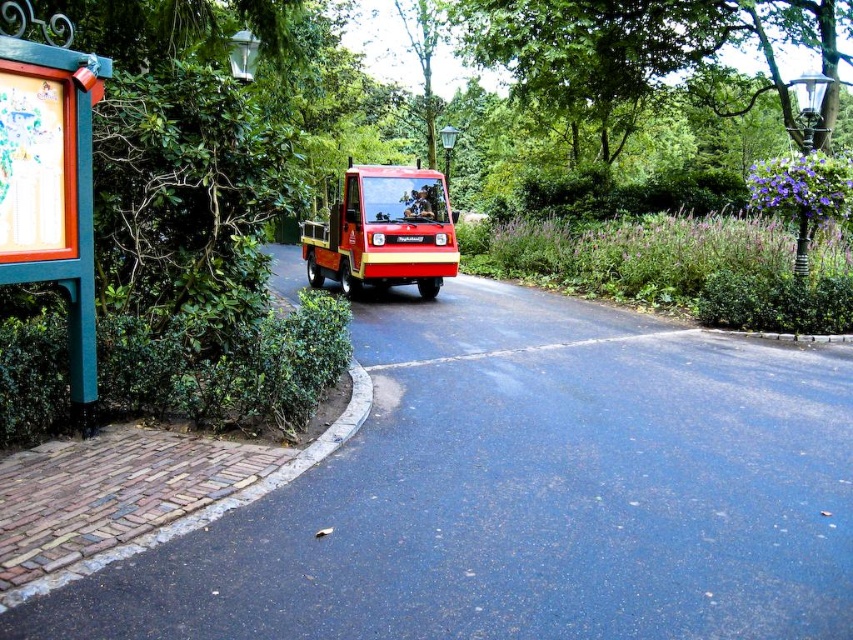
Does green leafy hedge at left have a greater height compared to red matte utility vehicle at center?

In fact, green leafy hedge at left may be shorter than red matte utility vehicle at center.

Does green leafy hedge at left appear under red matte utility vehicle at center?

Correct, green leafy hedge at left is located below red matte utility vehicle at center.

The width and height of the screenshot is (853, 640). I want to click on green leafy hedge at left, so click(224, 365).

Does green leafy hedge at left appear on the left side of wooden signboard at left?

In fact, green leafy hedge at left is to the right of wooden signboard at left.

Is green leafy hedge at left positioned in front of wooden signboard at left?

No, it is behind wooden signboard at left.

Measure the distance between point (180, 419) and camera.

Point (180, 419) is 6.16 meters from camera.

The image size is (853, 640). In order to click on green leafy hedge at left in this screenshot , I will do `click(224, 365)`.

Does wooden signboard at left have a lesser width compared to red matte utility vehicle at center?

Yes.

Measure the distance between wooden signboard at left and red matte utility vehicle at center.

The distance of wooden signboard at left from red matte utility vehicle at center is 27.83 feet.

What do you see at coordinates (50, 180) in the screenshot?
I see `wooden signboard at left` at bounding box center [50, 180].

This screenshot has height=640, width=853. Identify the location of wooden signboard at left. (50, 180).